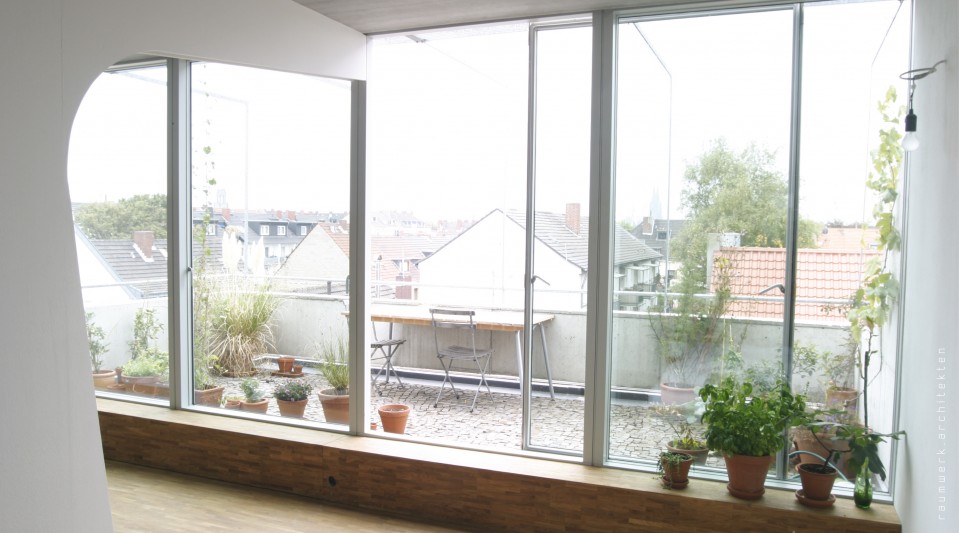
This screenshot has height=533, width=959. In order to click on chair in this screenshot , I will do `click(471, 353)`, `click(395, 350)`.